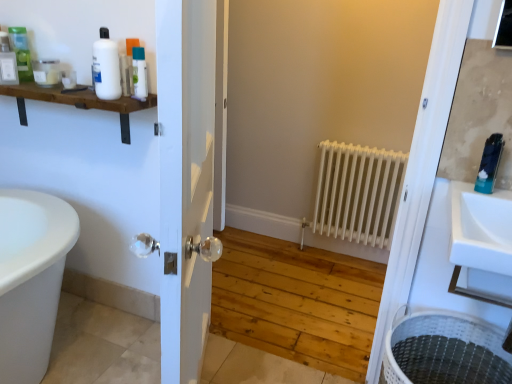
Where is `vacant position to the left of white glass door at center`? Image resolution: width=512 pixels, height=384 pixels. vacant position to the left of white glass door at center is located at coordinates (102, 351).